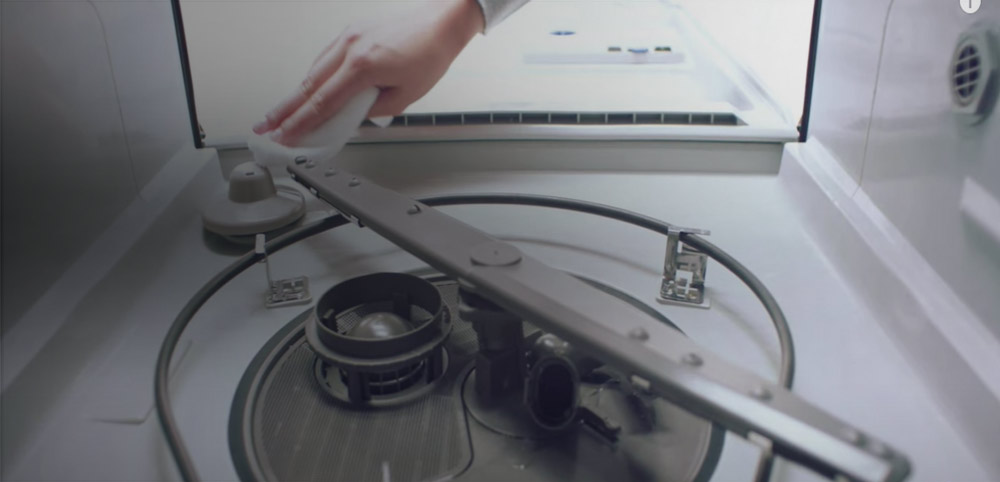
At what (x,y) coordinates should I click in order to perform the action: click on detergent dispenser. Please return your answer as a coordinate pair (x, y). This screenshot has width=1000, height=482. Looking at the image, I should click on (624, 42).